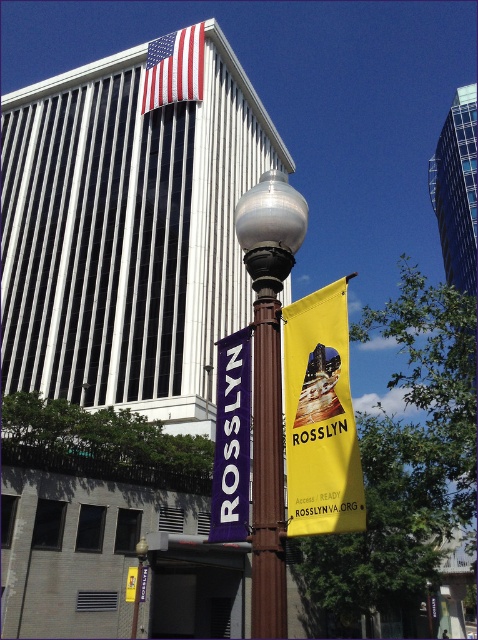
You are a city planner reviewing the layout of the urban area. The yellow fabric banner at center is part of a public information campaign. Based on its coordinates, can you determine if it is positioned to the left or right of the lamppost with two banners hanging from it?

The yellow fabric banner at center is positioned to the right of the lamppost with two banners hanging from it because its coordinates at point (321, 417) place it in the right side of the image.

You are a photographer aiming to capture the polished brass street light at center and the american flag at upper center in the same frame. Based on their positions, can you determine which object is closer to the camera?

The polished brass street light at center is positioned under the american flag at upper center, so the street light is closer to the camera than the flag.

You are a photographer standing in front of the lamppost with the yellow fabric banner at center and the purple fabric banner at center. You want to capture a photo where both banners are visible. Which banner should you adjust your camera angle to look up towards?

You should adjust your camera angle to look up towards the yellow fabric banner at center because it is above the purple fabric banner at center.